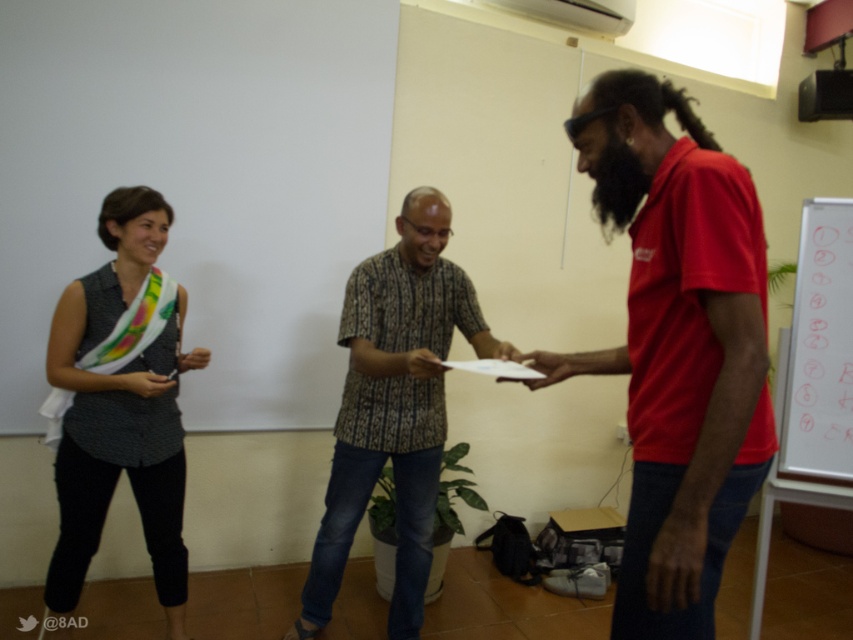
Question: Which object is closer to the camera taking this photo?

Choices:
 (A) matte black shirt at left
 (B) red matte shirt at right
 (C) white paperboard at right
 (D) brown patterned shirt at center

Answer: (B)

Question: Which object is the farthest from the matte black shirt at left?

Choices:
 (A) red matte shirt at right
 (B) white paperboard at right

Answer: (B)

Question: Which of the following is the closest to the observer?

Choices:
 (A) tap(396, 572)
 (B) tap(844, 218)

Answer: (B)

Question: Does red matte shirt at right appear under brown patterned shirt at center?

Choices:
 (A) yes
 (B) no

Answer: (B)

Question: Is red matte shirt at right below white paperboard at right?

Choices:
 (A) yes
 (B) no

Answer: (A)

Question: Considering the relative positions of red matte shirt at right and brown patterned shirt at center in the image provided, where is red matte shirt at right located with respect to brown patterned shirt at center?

Choices:
 (A) above
 (B) below

Answer: (A)